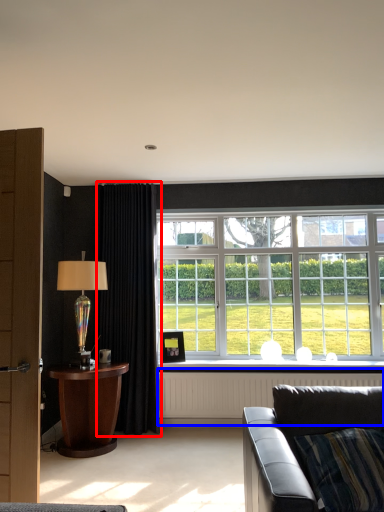
Question: Which point is closer to the camera, curtain (highlighted by a red box) or radiator (highlighted by a blue box)?

Choices:
 (A) curtain
 (B) radiator

Answer: (A)